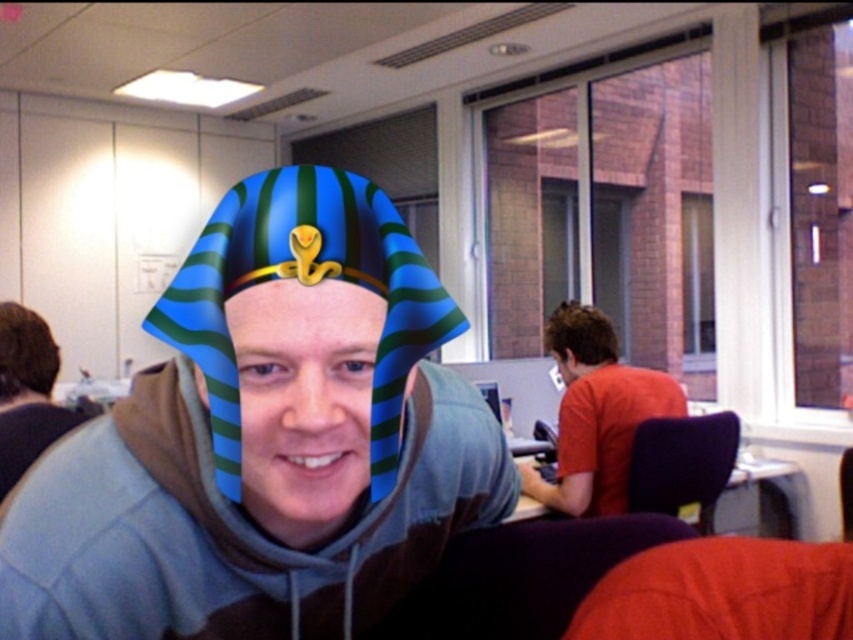
Which is behind, point (561, 442) or point (608, 339)?

The point (608, 339) is more distant.

Is point (618, 444) less distant than point (544, 339)?

Yes, it is in front of point (544, 339).

Where is `orange t-shirt at right`? The height and width of the screenshot is (640, 853). orange t-shirt at right is located at coordinates (596, 413).

Between blue striped cloth at center and orange t-shirt at right, which one appears on the right side from the viewer's perspective?

orange t-shirt at right is more to the right.

Does blue striped cloth at center appear under orange t-shirt at right?

Incorrect, blue striped cloth at center is not positioned below orange t-shirt at right.

Locate an element on the screen. blue striped cloth at center is located at coordinates (265, 440).

Describe the element at coordinates (25, 355) in the screenshot. I see `brown hair at left` at that location.

Does brown hair at left have a greater height compared to brown hair at right?

Yes.

This screenshot has height=640, width=853. Describe the element at coordinates (25, 355) in the screenshot. I see `brown hair at left` at that location.

In order to click on brown hair at left in this screenshot , I will do `click(25, 355)`.